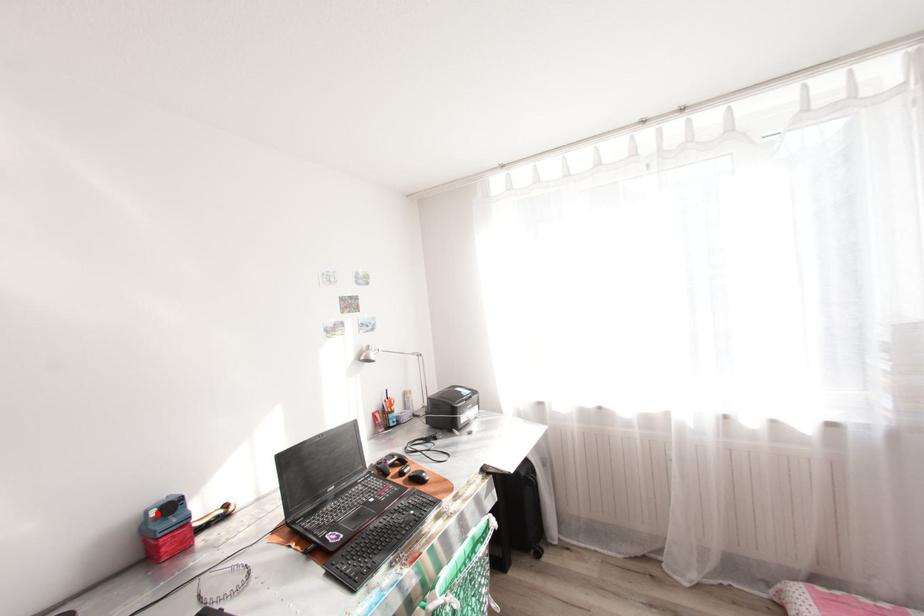
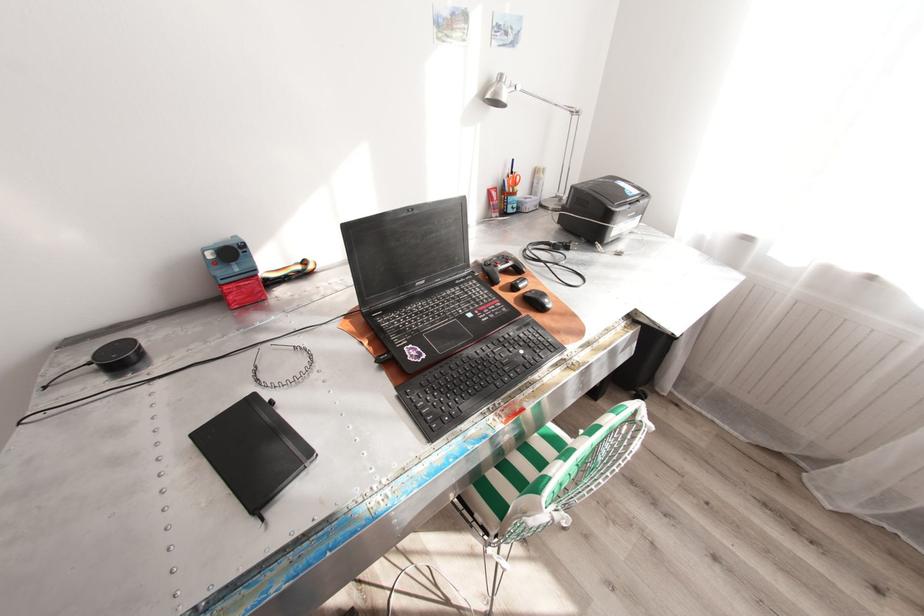
The point at the highlighted location is marked in the first image. Where is the corresponding point in the second image?

(215, 254)